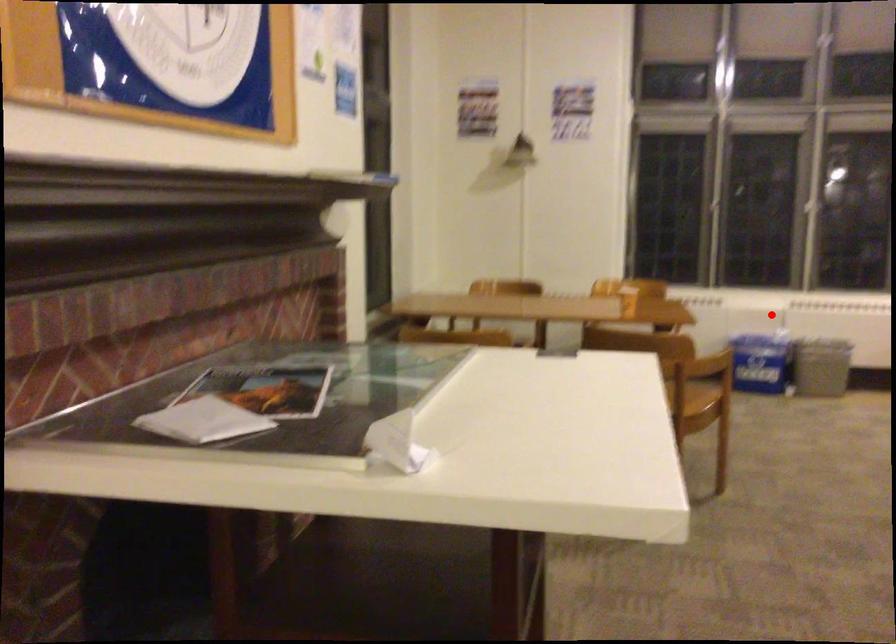
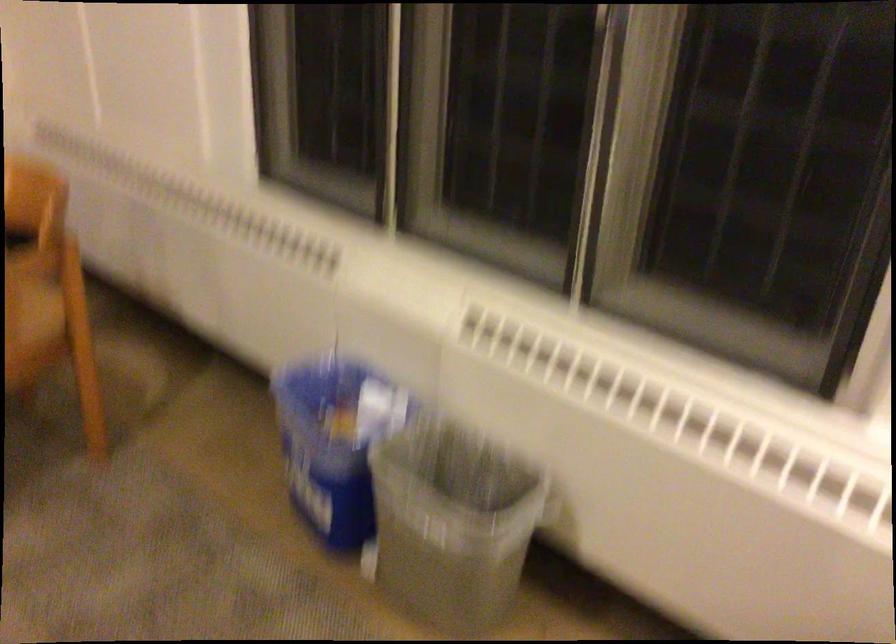
Question: I am providing you with two images of the same scene from different viewpoints. Given a red point in image1, look at the same physical point in image2. Is it:

Choices:
 (A) Closer to the viewpoint
 (B) Farther from the viewpoint

Answer: (A)